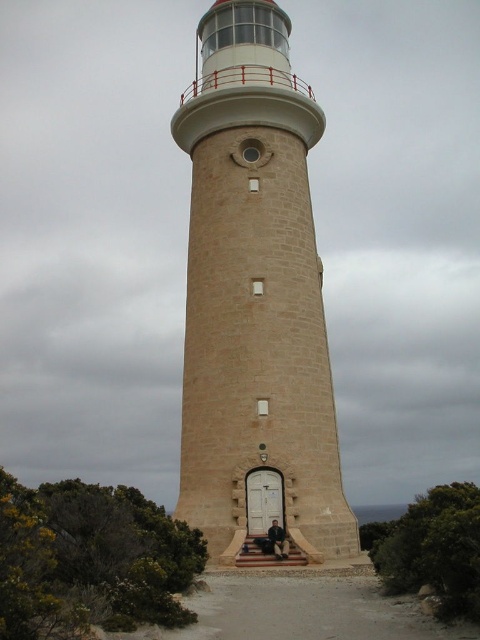
You are standing at the base of the beige stone lighthouse at center and want to reach the wooden staircase at center. Which direction should you walk to get there?

You should walk to the right because the beige stone lighthouse at center is to the left of the wooden staircase at center, so moving right will lead you towards the staircase.

You are standing in front of the beige stone lighthouse at center and the dark brown leather chair at center. Which object is nearer to you?

The beige stone lighthouse at center is closer to the viewer than the dark brown leather chair at center, so the beige stone lighthouse at center is nearer.

You are standing at the base of the lighthouse and see two points marked on the lighthouse structure. The first point is at coordinates point (272,564) and the second is at point (278,532). Which point is closer to you?

Point (272,564) is in front of point (278,532), so it is closer to you.